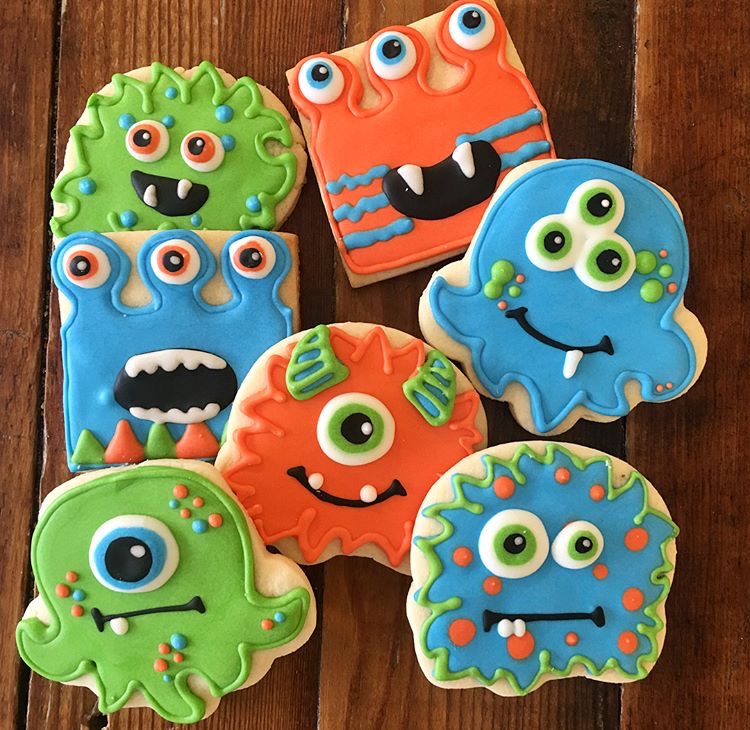
Locate an element on the screen. The height and width of the screenshot is (730, 750). grooves between planks of table is located at coordinates (42, 250), (333, 268), (634, 123).